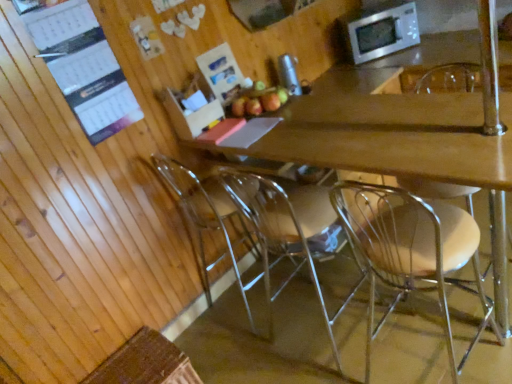
Find the location of `vacant space situated on the left part of clear acrylic chair at center, acting as the second chair starting from the left`. vacant space situated on the left part of clear acrylic chair at center, acting as the second chair starting from the left is located at coordinates coord(253,351).